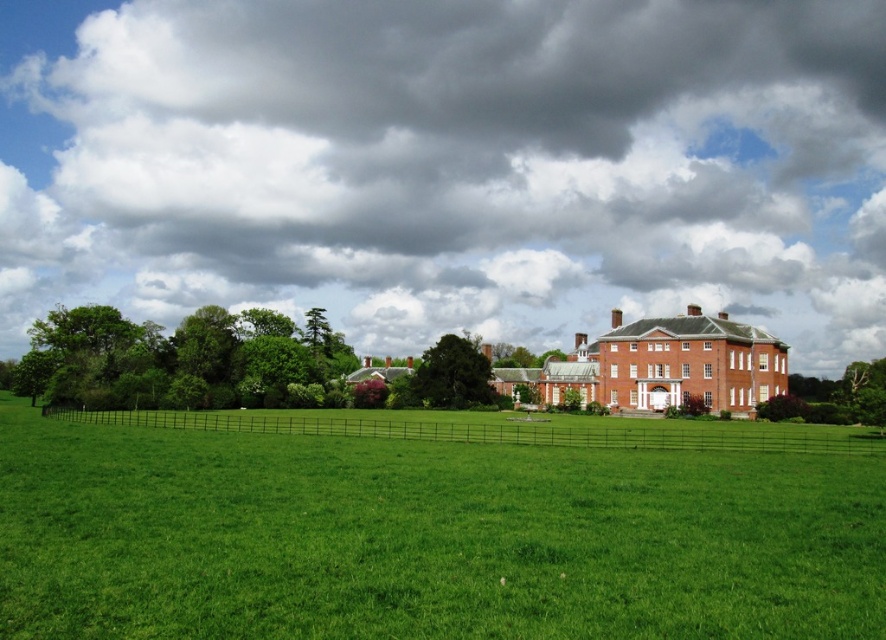
Is point (118, 204) in front of point (436, 380)?

That is False.

Which is more to the left, dark gray cloud at upper center or green leafy tree at center?

Positioned to the left is dark gray cloud at upper center.

The image size is (886, 640). What are the coordinates of `dark gray cloud at upper center` in the screenshot? It's located at (449, 164).

Who is shorter, green grass at center or green leafy tree at center?

green grass at center is shorter.

Does green grass at center appear on the left side of green leafy tree at center?

Indeed, green grass at center is positioned on the left side of green leafy tree at center.

This screenshot has width=886, height=640. In order to click on green grass at center in this screenshot , I will do click(x=426, y=538).

From the picture: Is green grass at center positioned at the back of green leafy tree at left?

No.

Is green grass at center shorter than green leafy tree at left?

Yes, green grass at center is shorter than green leafy tree at left.

Identify the location of green grass at center. point(426,538).

This screenshot has width=886, height=640. What are the coordinates of `green grass at center` in the screenshot? It's located at (426, 538).